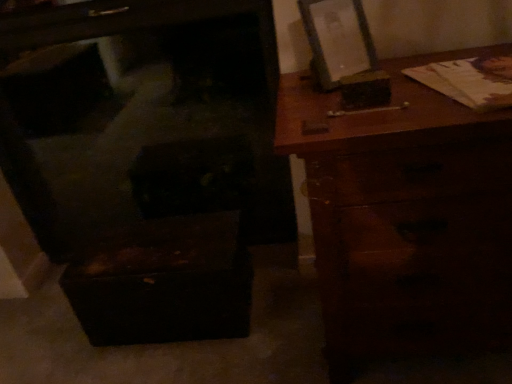
Question: Is the position of wooden chest at lower left more distant than that of wooden picture frame at upper right?

Choices:
 (A) no
 (B) yes

Answer: (B)

Question: Is wooden chest at lower left not within wooden picture frame at upper right?

Choices:
 (A) yes
 (B) no

Answer: (A)

Question: Is the depth of wooden chest at lower left less than that of wooden picture frame at upper right?

Choices:
 (A) no
 (B) yes

Answer: (A)

Question: From the image's perspective, would you say wooden chest at lower left is shown under wooden picture frame at upper right?

Choices:
 (A) yes
 (B) no

Answer: (A)

Question: Does wooden chest at lower left appear on the right side of wooden picture frame at upper right?

Choices:
 (A) yes
 (B) no

Answer: (B)

Question: Considering the positions of wooden picture frame at upper right and wooden chest at lower left in the image, is wooden picture frame at upper right bigger or smaller than wooden chest at lower left?

Choices:
 (A) small
 (B) big

Answer: (A)

Question: From the image's perspective, is wooden picture frame at upper right positioned above or below wooden chest at lower left?

Choices:
 (A) above
 (B) below

Answer: (A)

Question: Would you say wooden picture frame at upper right is to the left or to the right of wooden chest at lower left in the picture?

Choices:
 (A) right
 (B) left

Answer: (A)

Question: From a real-world perspective, is wooden picture frame at upper right physically located above or below wooden chest at lower left?

Choices:
 (A) below
 (B) above

Answer: (B)

Question: Is point (433, 288) closer or farther from the camera than point (69, 238)?

Choices:
 (A) closer
 (B) farther

Answer: (A)

Question: Looking at the image, does brown wooden chest of drawers at right seem bigger or smaller compared to wooden chest at lower left?

Choices:
 (A) small
 (B) big

Answer: (B)

Question: Is brown wooden chest of drawers at right spatially inside wooden chest at lower left, or outside of it?

Choices:
 (A) outside
 (B) inside

Answer: (A)

Question: From a real-world perspective, is brown wooden chest of drawers at right positioned above or below wooden chest at lower left?

Choices:
 (A) below
 (B) above

Answer: (A)

Question: Considering the relative positions of brown wooden chest of drawers at right and wooden picture frame at upper right in the image provided, is brown wooden chest of drawers at right to the left or to the right of wooden picture frame at upper right?

Choices:
 (A) right
 (B) left

Answer: (A)

Question: Considering the positions of brown wooden chest of drawers at right and wooden picture frame at upper right in the image, is brown wooden chest of drawers at right wider or thinner than wooden picture frame at upper right?

Choices:
 (A) thin
 (B) wide

Answer: (B)